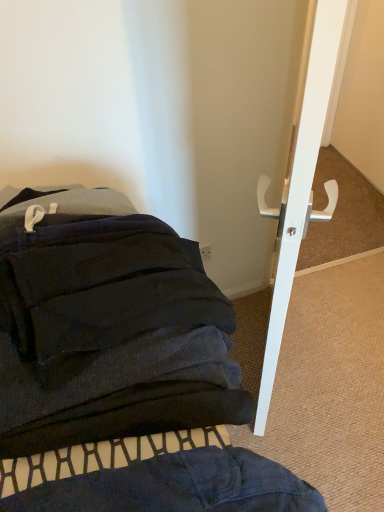
Question: Considering the relative sizes of white glossy door handle at upper right and dark blue fabric at lower left in the image provided, is white glossy door handle at upper right thinner than dark blue fabric at lower left?

Choices:
 (A) no
 (B) yes

Answer: (B)

Question: Is white glossy door handle at upper right at the left side of dark blue fabric at lower left?

Choices:
 (A) no
 (B) yes

Answer: (A)

Question: From the image's perspective, is white glossy door handle at upper right located above dark blue fabric at lower left?

Choices:
 (A) no
 (B) yes

Answer: (B)

Question: Is there a large distance between white glossy door handle at upper right and dark blue fabric at lower left?

Choices:
 (A) no
 (B) yes

Answer: (A)

Question: Is dark blue fabric at lower left surrounded by white glossy door handle at upper right?

Choices:
 (A) yes
 (B) no

Answer: (B)

Question: Does white glossy door handle at upper right have a lesser height compared to dark blue fabric at lower left?

Choices:
 (A) yes
 (B) no

Answer: (B)

Question: Is dark blue fabric at lower left to the left of white glossy door handle at upper right from the viewer's perspective?

Choices:
 (A) yes
 (B) no

Answer: (A)

Question: Is dark blue fabric at lower left outside of white glossy door handle at upper right?

Choices:
 (A) yes
 (B) no

Answer: (A)

Question: From a real-world perspective, is dark blue fabric at lower left located higher than white glossy door handle at upper right?

Choices:
 (A) no
 (B) yes

Answer: (A)

Question: Considering the relative sizes of dark blue fabric at lower left and white glossy door handle at upper right in the image provided, is dark blue fabric at lower left wider than white glossy door handle at upper right?

Choices:
 (A) yes
 (B) no

Answer: (A)

Question: Considering the relative sizes of dark blue fabric at lower left and white glossy door handle at upper right in the image provided, is dark blue fabric at lower left bigger than white glossy door handle at upper right?

Choices:
 (A) no
 (B) yes

Answer: (B)

Question: Is dark blue fabric at lower left facing away from white glossy door handle at upper right?

Choices:
 (A) yes
 (B) no

Answer: (B)

Question: Considering the relative positions of dark blue fabric at lower left and white glossy door handle at upper right in the image provided, is dark blue fabric at lower left to the left or to the right of white glossy door handle at upper right?

Choices:
 (A) left
 (B) right

Answer: (A)